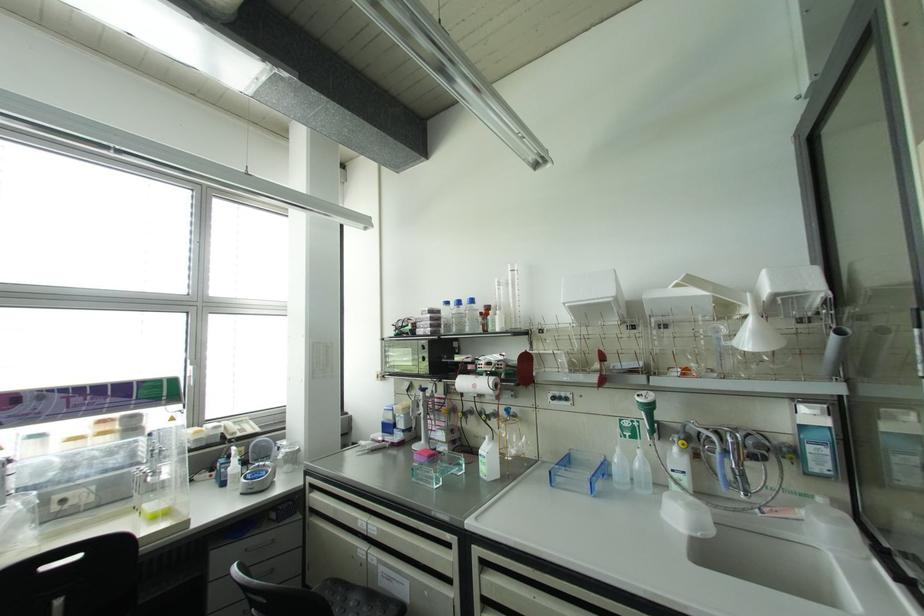
This screenshot has width=924, height=616. I want to click on white bottle pump, so click(619, 469).